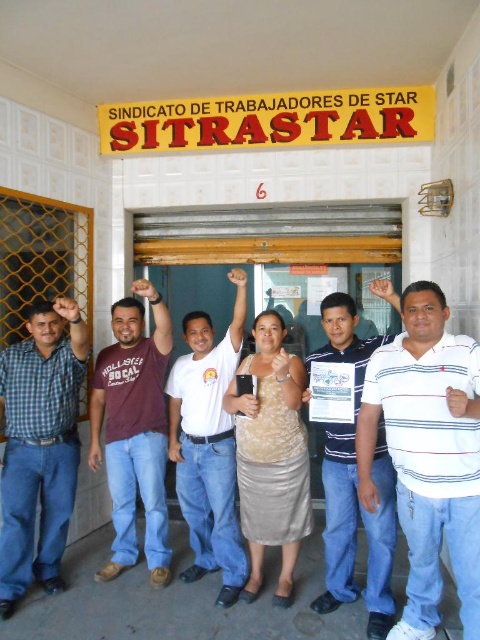
Is white striped shirt at center further to camera compared to white cotton shirt at center?

No, white striped shirt at center is in front of white cotton shirt at center.

Can you confirm if white striped shirt at center is positioned above white cotton shirt at center?

Incorrect, white striped shirt at center is not positioned above white cotton shirt at center.

Does point (384, 417) lie behind point (178, 410)?

No, it is not.

Image resolution: width=480 pixels, height=640 pixels. What are the coordinates of `white striped shirt at center` in the screenshot? It's located at (428, 454).

Does matte blue jeans at left have a larger size compared to blue striped shirt at center?

Yes.

Is point (47, 538) closer to viewer compared to point (351, 326)?

No, (47, 538) is further to viewer.

Does point (16, 582) come farther from viewer compared to point (344, 541)?

Yes, point (16, 582) is behind point (344, 541).

Where is `matte blue jeans at left`? Image resolution: width=480 pixels, height=640 pixels. matte blue jeans at left is located at coordinates (39, 445).

In the scene shown: Is white striped shirt at center further to the viewer compared to matte blue jeans at left?

No, white striped shirt at center is in front of matte blue jeans at left.

Who is shorter, white striped shirt at center or matte blue jeans at left?

matte blue jeans at left

Locate an element on the screen. white striped shirt at center is located at coordinates (428, 454).